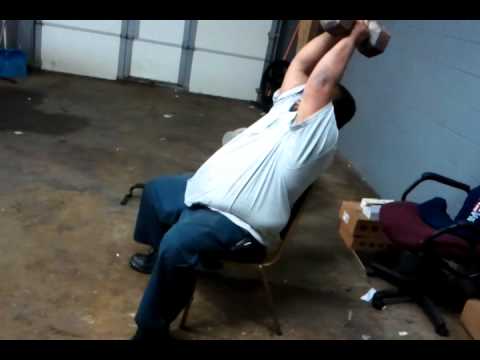
Identify the location of boxes. This screenshot has height=360, width=480. (345, 219), (345, 237), (470, 322), (372, 209).